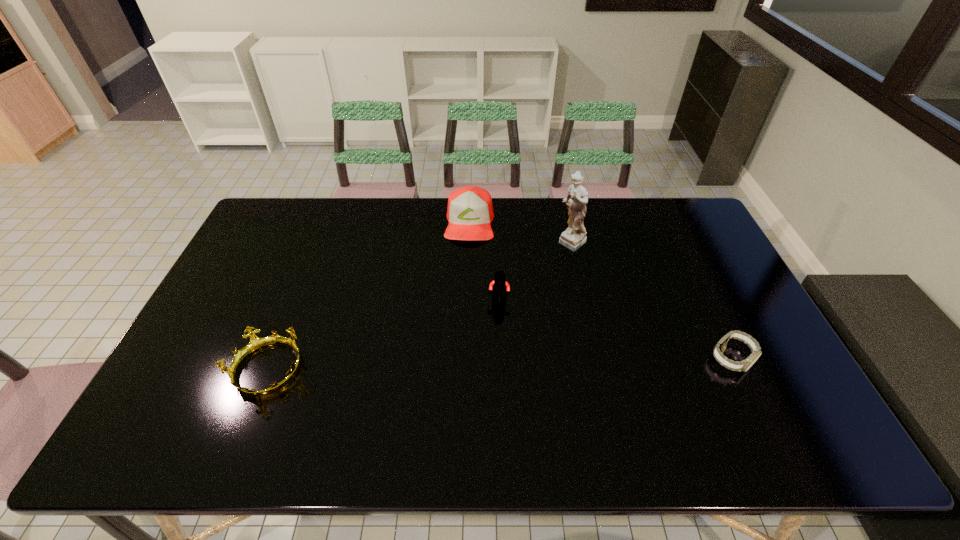
Locate an element on the screen. The image size is (960, 540). blank area in the image that satisfies the following two spatial constraints: 1. on the front side of the second object from right to left; 2. on the left side of the baseball cap is located at coordinates (469, 244).

Identify the location of free spot that satisfies the following two spatial constraints: 1. on the front side of the rightmost object; 2. on the face of the third nearest object. The height and width of the screenshot is (540, 960). (501, 359).

Identify the location of vacant region that satisfies the following two spatial constraints: 1. on the front side of the rightmost object; 2. on the face of the third farthest object. (501, 359).

Locate an element on the screen. vacant area in the image that satisfies the following two spatial constraints: 1. on the back side of the crown; 2. on the right side of the baseball cap is located at coordinates coord(326,222).